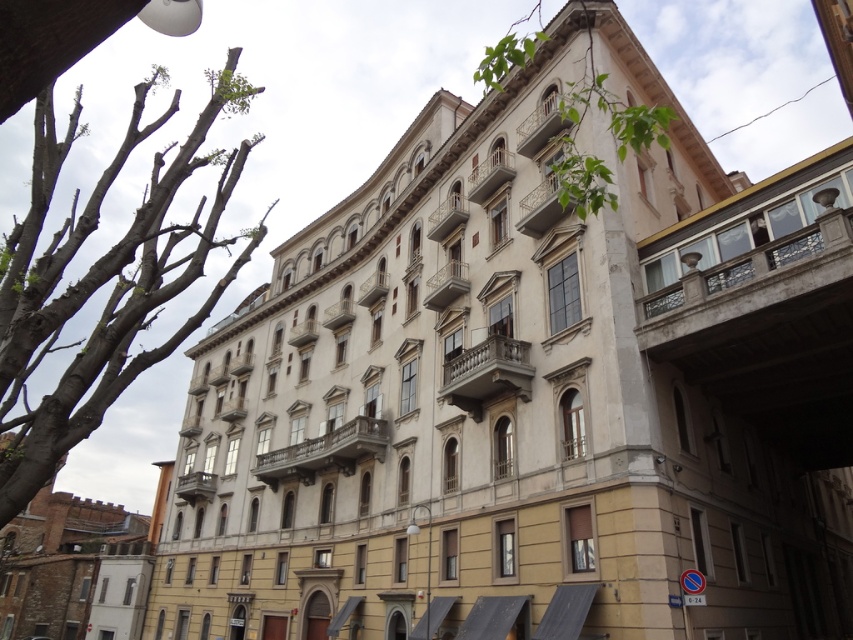
Question: Is bare wood tree at left to the right of green leafy tree at upper center from the viewer's perspective?

Choices:
 (A) no
 (B) yes

Answer: (A)

Question: Is bare wood tree at left to the left of green leafy tree at upper center from the viewer's perspective?

Choices:
 (A) no
 (B) yes

Answer: (B)

Question: Is bare wood tree at left to the right of green leafy tree at upper center from the viewer's perspective?

Choices:
 (A) no
 (B) yes

Answer: (A)